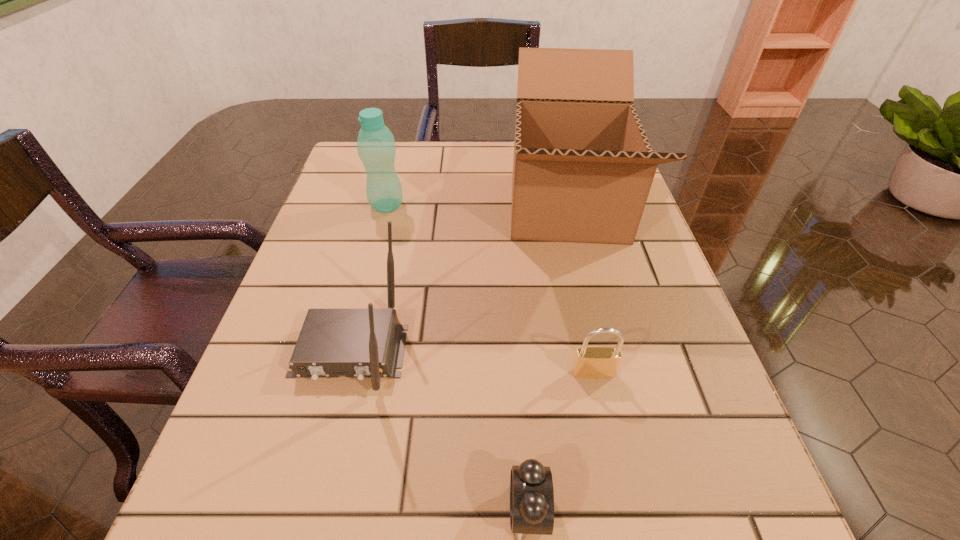
I want to click on empty space between the router and the bottle, so click(x=369, y=278).

Where is `unoccupied position between the padlock and the router`? The width and height of the screenshot is (960, 540). unoccupied position between the padlock and the router is located at coordinates (471, 362).

This screenshot has width=960, height=540. I want to click on vacant space that is in between the bottle and the router, so click(369, 278).

Where is `unoccupied position between the fourth tallest object and the tallest object`? unoccupied position between the fourth tallest object and the tallest object is located at coordinates (580, 290).

Identify the location of vacant point located between the fourth tallest object and the router. The image size is (960, 540). (471, 362).

Where is `the closest object to the nearest object`? This screenshot has height=540, width=960. the closest object to the nearest object is located at coordinates (593, 362).

Identify which object is located as the nearest to the router. Please provide its 2D coordinates. Your answer should be formatted as a tuple, i.e. [(x, y)], where the tuple contains the x and y coordinates of a point satisfying the conditions above.

[(583, 167)]